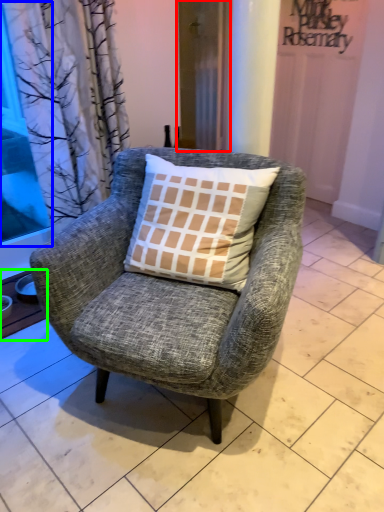
Question: Considering the real-world distances, which object is farthest from screen door (highlighted by a red box)? window screen (highlighted by a blue box) or window sill (highlighted by a green box)?

Choices:
 (A) window screen
 (B) window sill

Answer: (B)